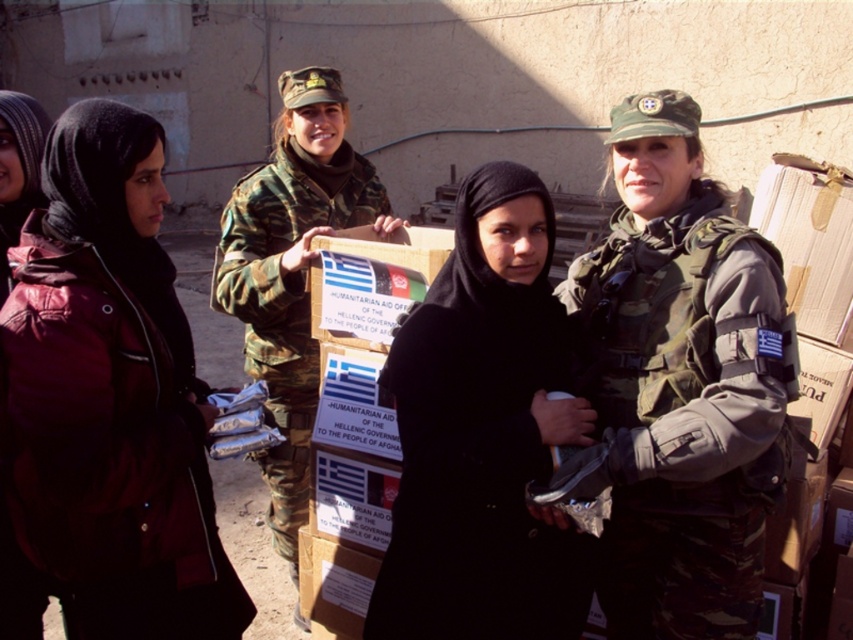
You are an aid worker in the field and need to pack your gear. You have a limited space in your backpack. Which item, the camo fabric vest at center or the camouflage fabric uniform at center, should you choose to carry if you want to save space?

The camo fabric vest at center occupies less space than the camouflage fabric uniform at center, so you should choose to carry the camo fabric vest at center to save space.

You are a photographer at the scene and want to capture both the matte black jacket at left and the matte red jacket at left in a single frame. Which jacket should you position closer to the left edge of the frame to ensure both are visible?

The matte red jacket at left should be positioned closer to the left edge of the frame because the matte black jacket at left is on its right side, so placing the red one further left ensures both are included in the shot.